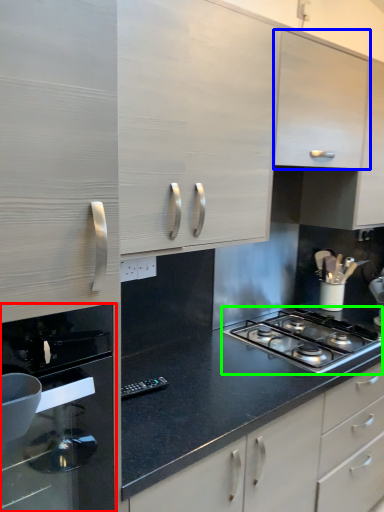
Question: Based on their relative distances, which object is nearer to home appliance (highlighted by a red box)? Choose from cabinetry (highlighted by a blue box) and gas stove (highlighted by a green box).

Choices:
 (A) cabinetry
 (B) gas stove

Answer: (B)